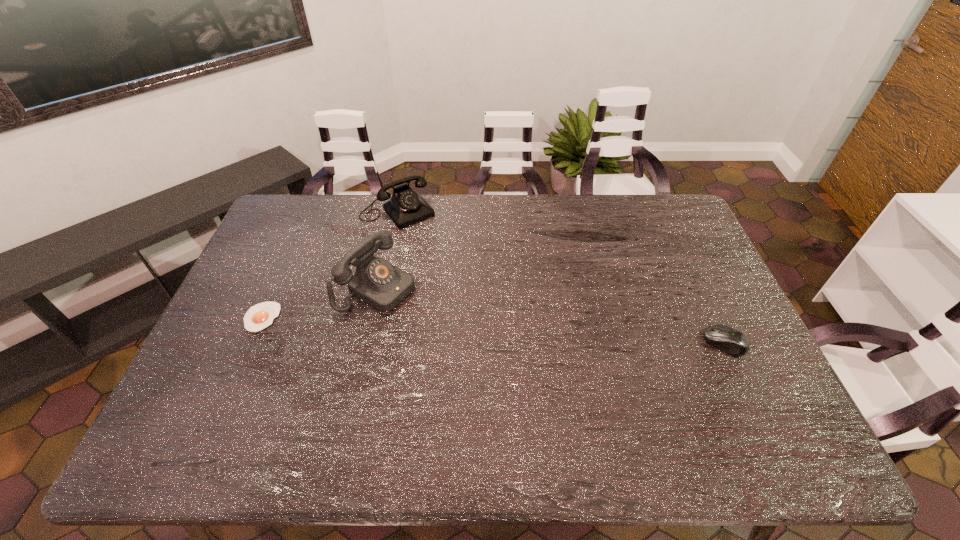
You are a GUI agent. You are given a task and a screenshot of the screen. Output one action in this format:
    pyautogui.click(x=<x>, y=<y>)
    Task: Click on the vacant space at the near edge of the desktop
    The image size is (960, 540).
    Given the screenshot: What is the action you would take?
    (693, 410)

The width and height of the screenshot is (960, 540). In the image, there is a desktop. In order to click on vacant space at the left edge in this screenshot , I will do [278, 281].

In order to click on free space at the right edge of the desktop in this screenshot , I will do `click(754, 348)`.

The width and height of the screenshot is (960, 540). In the image, there is a desktop. Identify the location of vacant region at the far right corner. (658, 195).

Identify the location of blank region between the shorter telephone and the third tallest object. This screenshot has width=960, height=540. (561, 278).

You are a GUI agent. You are given a task and a screenshot of the screen. Output one action in this format:
    pyautogui.click(x=<x>, y=<y>)
    Task: Click on the free space between the tallest object and the mouse
    The height and width of the screenshot is (540, 960).
    Given the screenshot: What is the action you would take?
    pyautogui.click(x=551, y=314)

At what (x,y) coordinates should I click in order to perform the action: click on free space between the second tallest object and the rightmost object. Please return your answer as a coordinate pair (x, y). Image resolution: width=960 pixels, height=540 pixels. Looking at the image, I should click on (561, 278).

Locate an element on the screen. The width and height of the screenshot is (960, 540). empty space between the leftmost object and the nearer telephone is located at coordinates (320, 301).

You are a GUI agent. You are given a task and a screenshot of the screen. Output one action in this format:
    pyautogui.click(x=<x>, y=<y>)
    Task: Click on the vacant space in between the shortest object and the mouse
    Image resolution: width=960 pixels, height=540 pixels.
    Given the screenshot: What is the action you would take?
    pyautogui.click(x=492, y=330)

The image size is (960, 540). I want to click on free space between the third tallest object and the farthest object, so click(561, 278).